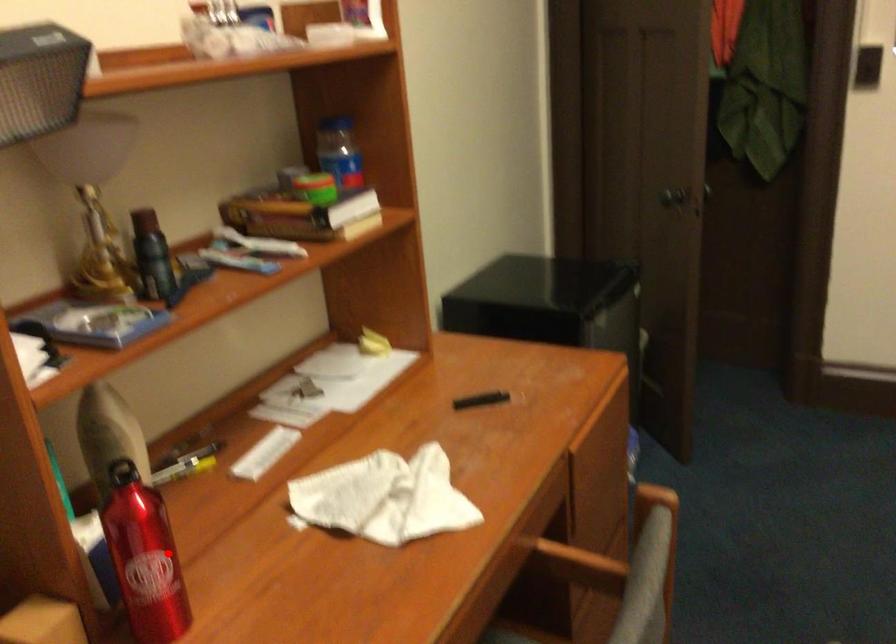
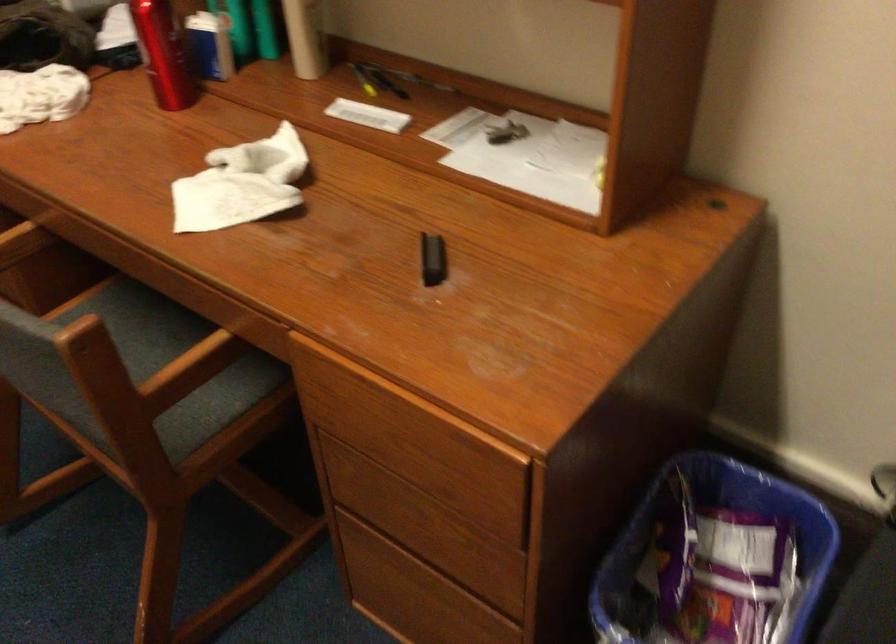
Locate, in the second image, the point that corresponds to the highlighted location in the first image.

(162, 53)